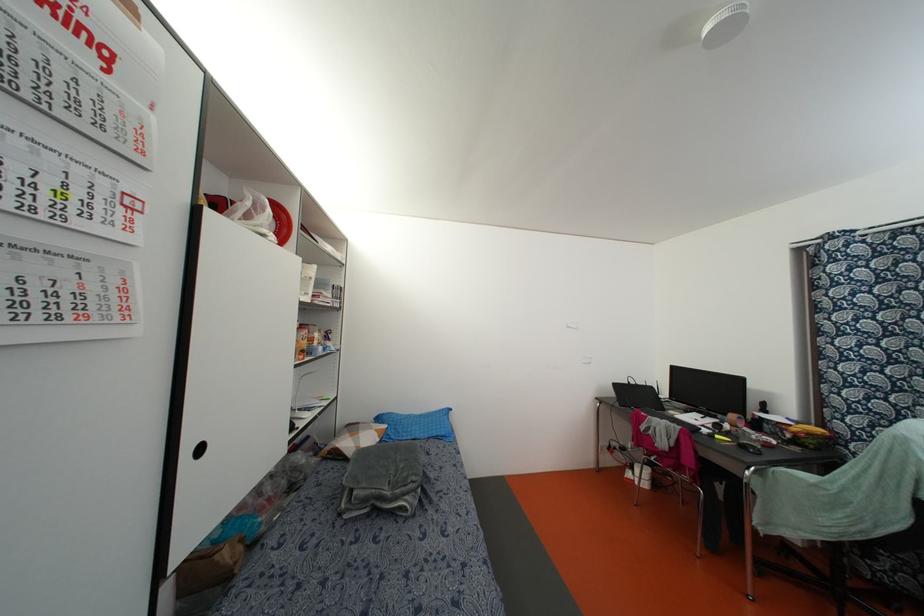
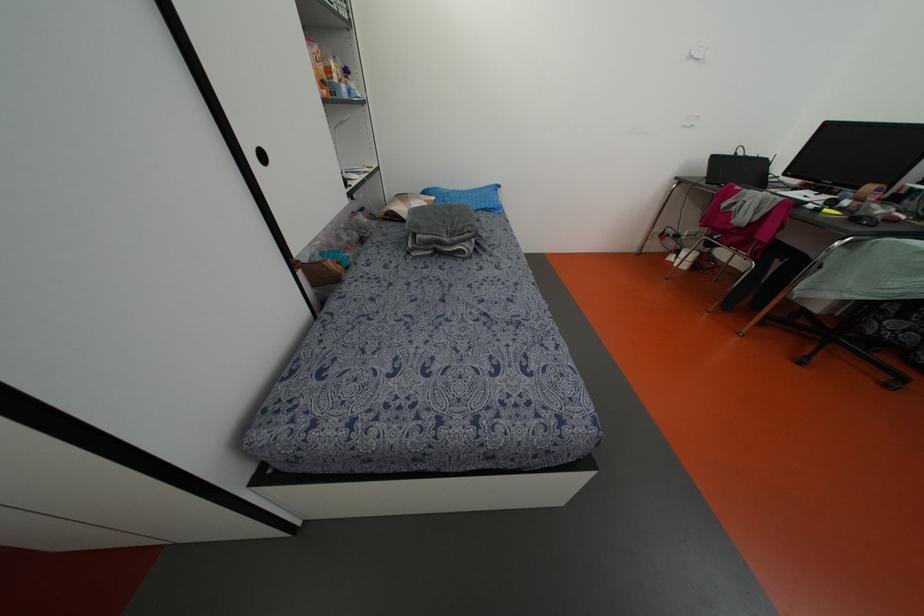
In the second image, find the point that corresponds to the point at 354,493 in the first image.

(418, 236)